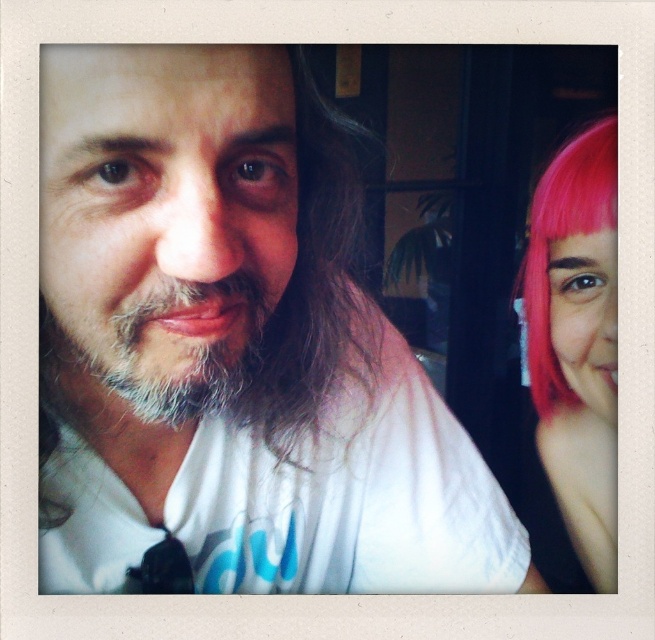
In the scene shown: You are a photographer trying to capture both the white matte shirt at center and the pink hair at right in a single frame. Since you want to emphasize the size difference between them, which object should you focus on to ensure the larger one is properly highlighted?

The white matte shirt at center is bigger than the pink hair at right, so focusing on the white matte shirt at center will ensure the larger object is properly highlighted.

You are standing in the room depicted in the image and want to reach a point that is exactly at coordinates point (333, 355). If you can extend your arm 20 inches, will you be able to touch that point?

The distance of point (333, 355) from viewer is 19.86 inches. Since your arm can extend 20 inches, you can just barely touch the point as it is within reach.